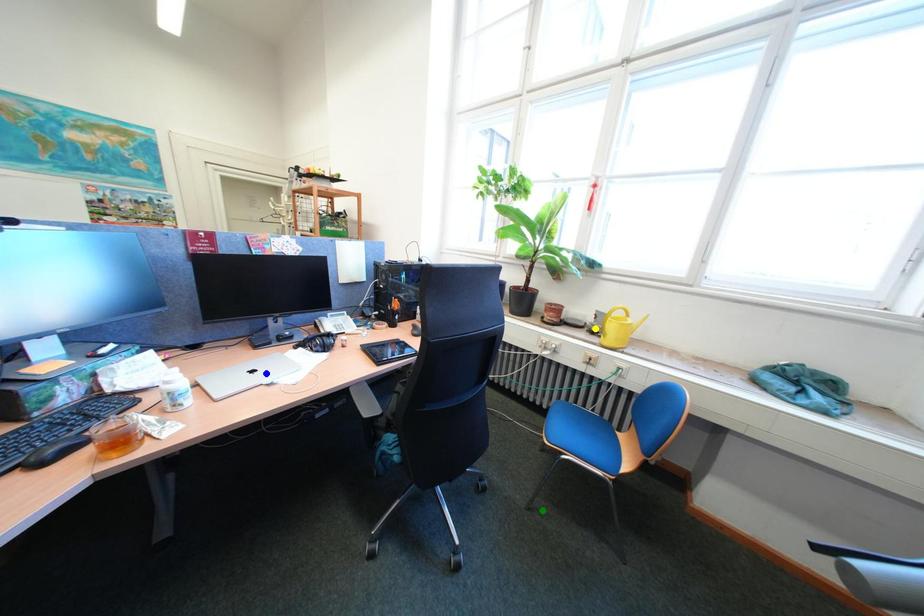
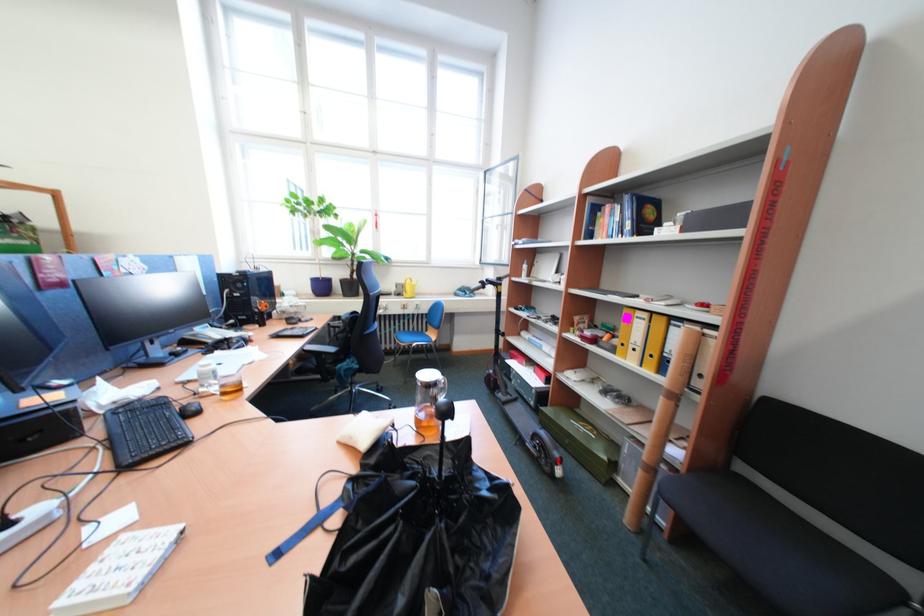
I am providing you with two images of the same scene from different viewpoints. Three points are marked in image1. Which point corresponds to a part or object that is occluded in image2?In image1, three points are marked. Which of them correspond to a part or object that is occluded in image2?Among the three points shown in image1, which one corresponds to a part or object that is no longer visible due to occlusion in image2?

blue point cannot be seen in image2.